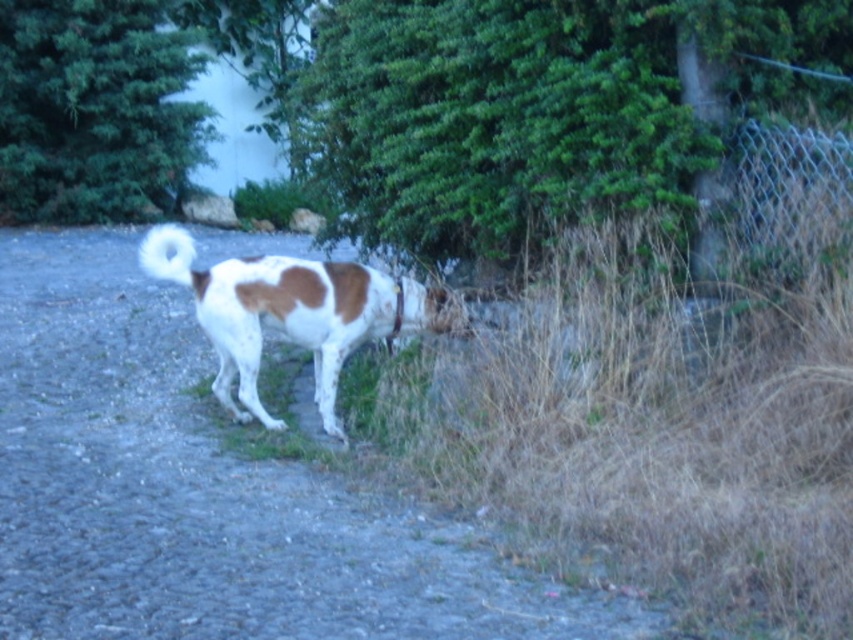
Question: Observing the image, what is the correct spatial positioning of brown and white fur at center in reference to wire mesh fence at right?

Choices:
 (A) below
 (B) above

Answer: (A)

Question: Among these points, which one is farthest from the camera?

Choices:
 (A) (155, 276)
 (B) (254, 320)
 (C) (786, 196)
 (D) (83, 317)

Answer: (D)

Question: Which object is positioned closest to the brown and white fur at center?

Choices:
 (A) white fluffy tail at upper left
 (B) dirt track at center
 (C) wire mesh fence at right

Answer: (A)

Question: Can you confirm if brown and white fur at center is positioned to the right of wire mesh fence at right?

Choices:
 (A) yes
 (B) no

Answer: (B)

Question: Which object is positioned closest to the brown and white fur at center?

Choices:
 (A) dirt track at center
 (B) white fluffy tail at upper left
 (C) wire mesh fence at right

Answer: (B)

Question: Does dirt track at center have a smaller size compared to brown and white fur at center?

Choices:
 (A) no
 (B) yes

Answer: (A)